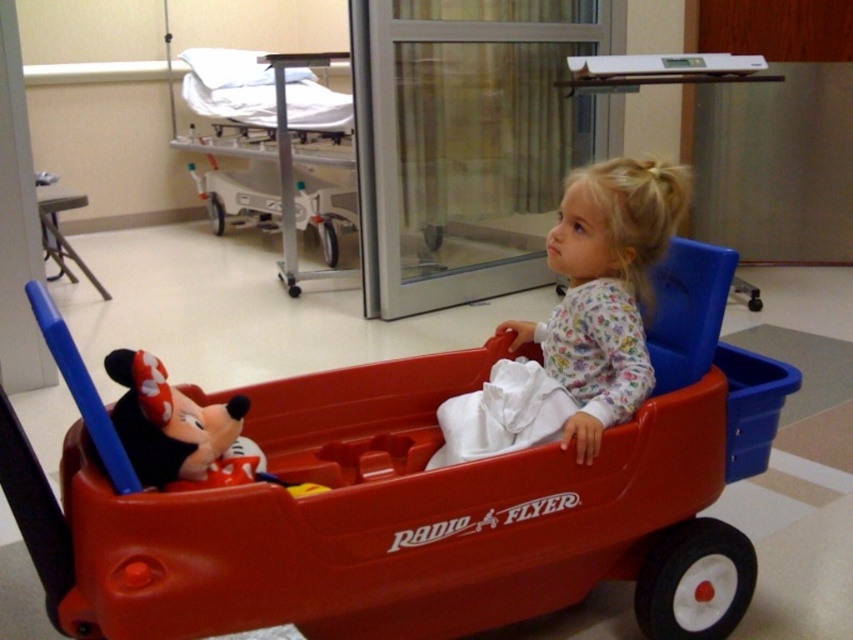
Between matte plastic wagon at center and white fabric hospital bed at upper center, which one is positioned higher?

white fabric hospital bed at upper center is higher up.

Which is below, matte plastic wagon at center or white fabric hospital bed at upper center?

matte plastic wagon at center is lower down.

This screenshot has height=640, width=853. What do you see at coordinates (427, 496) in the screenshot? I see `matte plastic wagon at center` at bounding box center [427, 496].

At what (x,y) coordinates should I click in order to perform the action: click on matte plastic wagon at center. Please return your answer as a coordinate pair (x, y). The image size is (853, 640). Looking at the image, I should click on [x=427, y=496].

How much distance is there between matte plastic wagon at center and matte plush mickey mouse at lower left?

matte plastic wagon at center is 45.40 centimeters away from matte plush mickey mouse at lower left.

Where is `matte plastic wagon at center`? matte plastic wagon at center is located at coordinates (427, 496).

Where is `matte plastic wagon at center`? The image size is (853, 640). matte plastic wagon at center is located at coordinates (427, 496).

Does white fabric hospital bed at upper center come behind matte plush mickey mouse at lower left?

Yes, white fabric hospital bed at upper center is further from the viewer.

Can you confirm if white fabric hospital bed at upper center is positioned to the right of matte plush mickey mouse at lower left?

Incorrect, white fabric hospital bed at upper center is not on the right side of matte plush mickey mouse at lower left.

Is point (273, 196) farther from camera compared to point (151, 424)?

Yes, it is behind point (151, 424).

You are a GUI agent. You are given a task and a screenshot of the screen. Output one action in this format:
    pyautogui.click(x=<x>, y=<y>)
    Task: Click on the white fabric hospital bed at upper center
    This screenshot has height=640, width=853.
    Given the screenshot: What is the action you would take?
    pyautogui.click(x=276, y=145)